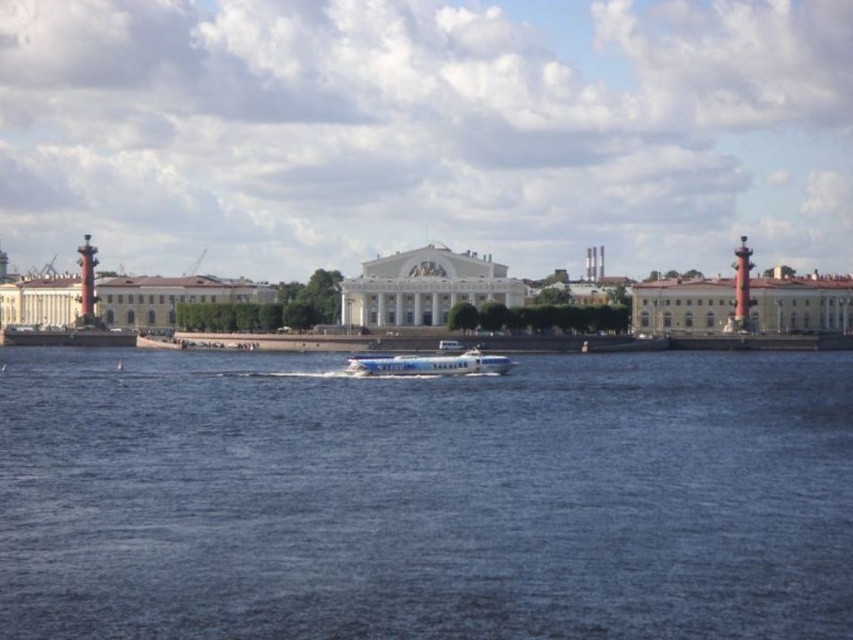
Question: Does blue water at center appear over white glossy boat at center?

Choices:
 (A) no
 (B) yes

Answer: (A)

Question: Observing the image, what is the correct spatial positioning of blue water at center in reference to white glossy boat at center?

Choices:
 (A) above
 (B) below

Answer: (B)

Question: Where is blue water at center located in relation to white glossy boat at center in the image?

Choices:
 (A) above
 (B) below

Answer: (B)

Question: Which point appears farthest from the camera in this image?

Choices:
 (A) (483, 371)
 (B) (357, 308)
 (C) (444, 515)

Answer: (B)

Question: Among these points, which one is nearest to the camera?

Choices:
 (A) (387, 312)
 (B) (303, 378)

Answer: (B)

Question: Which point is farther to the camera?

Choices:
 (A) blue water at center
 (B) white glossy boat at center

Answer: (B)